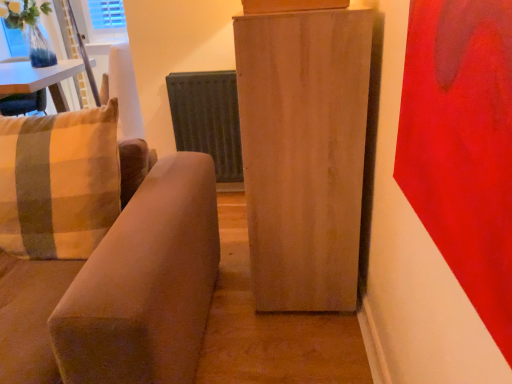
Question: From the image's perspective, would you say light wood cabinet at center is shown under plaid fabric pillow at left?

Choices:
 (A) no
 (B) yes

Answer: (A)

Question: From a real-world perspective, is light wood cabinet at center under plaid fabric pillow at left?

Choices:
 (A) no
 (B) yes

Answer: (B)

Question: From a real-world perspective, is light wood cabinet at center on top of plaid fabric pillow at left?

Choices:
 (A) no
 (B) yes

Answer: (A)

Question: Considering the relative sizes of light wood cabinet at center and plaid fabric pillow at left in the image provided, is light wood cabinet at center shorter than plaid fabric pillow at left?

Choices:
 (A) no
 (B) yes

Answer: (A)

Question: Is light wood cabinet at center with plaid fabric pillow at left?

Choices:
 (A) no
 (B) yes

Answer: (A)

Question: In terms of height, does metallic gray radiator at center look taller or shorter compared to plaid fabric pillow at left?

Choices:
 (A) short
 (B) tall

Answer: (B)

Question: Based on their sizes in the image, would you say metallic gray radiator at center is bigger or smaller than plaid fabric pillow at left?

Choices:
 (A) small
 (B) big

Answer: (A)

Question: Does point (240, 157) appear closer or farther from the camera than point (106, 175)?

Choices:
 (A) farther
 (B) closer

Answer: (A)

Question: Is metallic gray radiator at center in front of or behind plaid fabric pillow at left in the image?

Choices:
 (A) front
 (B) behind

Answer: (B)

Question: Looking at the image, does plaid fabric pillow at left seem bigger or smaller compared to metallic gray radiator at center?

Choices:
 (A) big
 (B) small

Answer: (A)

Question: Visually, is plaid fabric pillow at left positioned to the left or to the right of metallic gray radiator at center?

Choices:
 (A) left
 (B) right

Answer: (A)

Question: From their relative heights in the image, would you say plaid fabric pillow at left is taller or shorter than metallic gray radiator at center?

Choices:
 (A) tall
 (B) short

Answer: (B)

Question: Considering their positions, is plaid fabric pillow at left located in front of or behind metallic gray radiator at center?

Choices:
 (A) front
 (B) behind

Answer: (A)

Question: Looking at their shapes, would you say metallic gray radiator at center is wider or thinner than light wood cabinet at center?

Choices:
 (A) wide
 (B) thin

Answer: (B)

Question: Is metallic gray radiator at center taller or shorter than light wood cabinet at center?

Choices:
 (A) short
 (B) tall

Answer: (A)